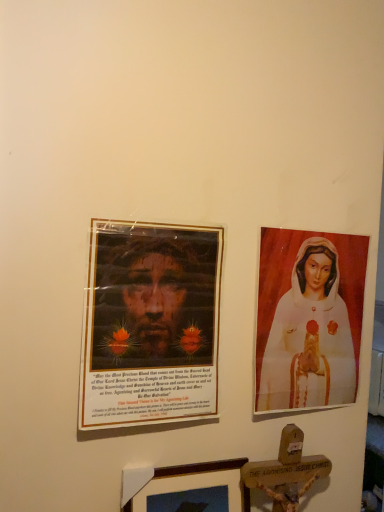
Question: Considering the relative sizes of wooden picture frame at lower center and white glossy statue at right in the image provided, is wooden picture frame at lower center wider than white glossy statue at right?

Choices:
 (A) yes
 (B) no

Answer: (A)

Question: Considering the relative sizes of wooden picture frame at lower center and white glossy statue at right in the image provided, is wooden picture frame at lower center smaller than white glossy statue at right?

Choices:
 (A) yes
 (B) no

Answer: (A)

Question: Can you confirm if wooden picture frame at lower center is thinner than white glossy statue at right?

Choices:
 (A) no
 (B) yes

Answer: (A)

Question: Is wooden picture frame at lower center shorter than white glossy statue at right?

Choices:
 (A) no
 (B) yes

Answer: (B)

Question: Is wooden picture frame at lower center oriented away from white glossy statue at right?

Choices:
 (A) no
 (B) yes

Answer: (A)

Question: Does wooden picture frame at lower center have a larger size compared to white glossy statue at right?

Choices:
 (A) yes
 (B) no

Answer: (B)

Question: From the image's perspective, would you say white glossy statue at right is shown under wooden picture frame at lower center?

Choices:
 (A) no
 (B) yes

Answer: (A)

Question: From a real-world perspective, is white glossy statue at right located beneath wooden picture frame at lower center?

Choices:
 (A) no
 (B) yes

Answer: (A)

Question: Is white glossy statue at right turned away from wooden picture frame at lower center?

Choices:
 (A) no
 (B) yes

Answer: (A)

Question: Can you confirm if white glossy statue at right is thinner than wooden picture frame at lower center?

Choices:
 (A) no
 (B) yes

Answer: (B)

Question: Can you confirm if white glossy statue at right is positioned to the left of wooden picture frame at lower center?

Choices:
 (A) no
 (B) yes

Answer: (A)

Question: Can you confirm if white glossy statue at right is taller than wooden picture frame at lower center?

Choices:
 (A) yes
 (B) no

Answer: (A)

Question: Is white glossy statue at right spatially inside wooden picture frame at lower center, or outside of it?

Choices:
 (A) inside
 (B) outside

Answer: (B)